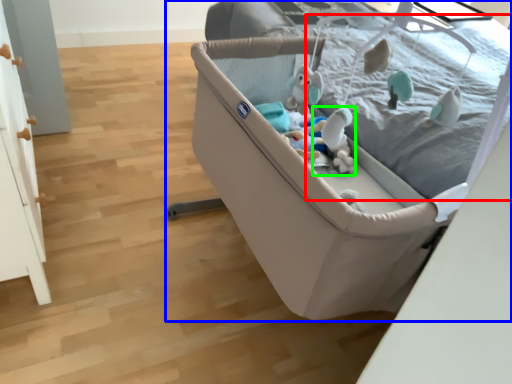
Question: Considering the real-world distances, which object is farthest from mattress (highlighted by a red box)? infant bed (highlighted by a blue box) or toy (highlighted by a green box)?

Choices:
 (A) infant bed
 (B) toy

Answer: (A)